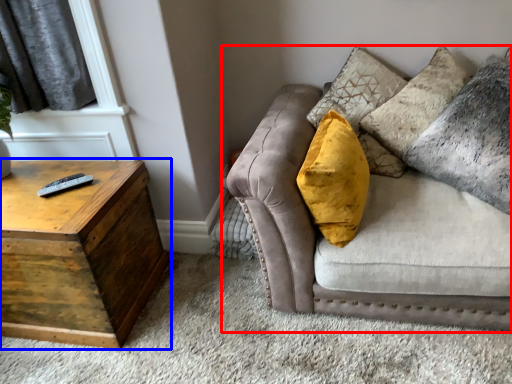
Question: Which of the following is the farthest to the observer, studio couch (highlighted by a red box) or table (highlighted by a blue box)?

Choices:
 (A) studio couch
 (B) table

Answer: (B)